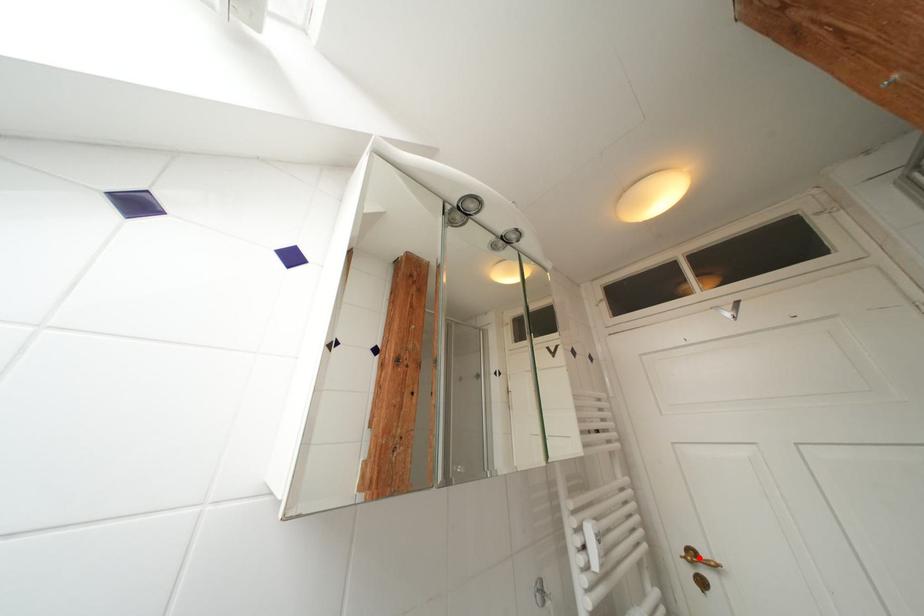
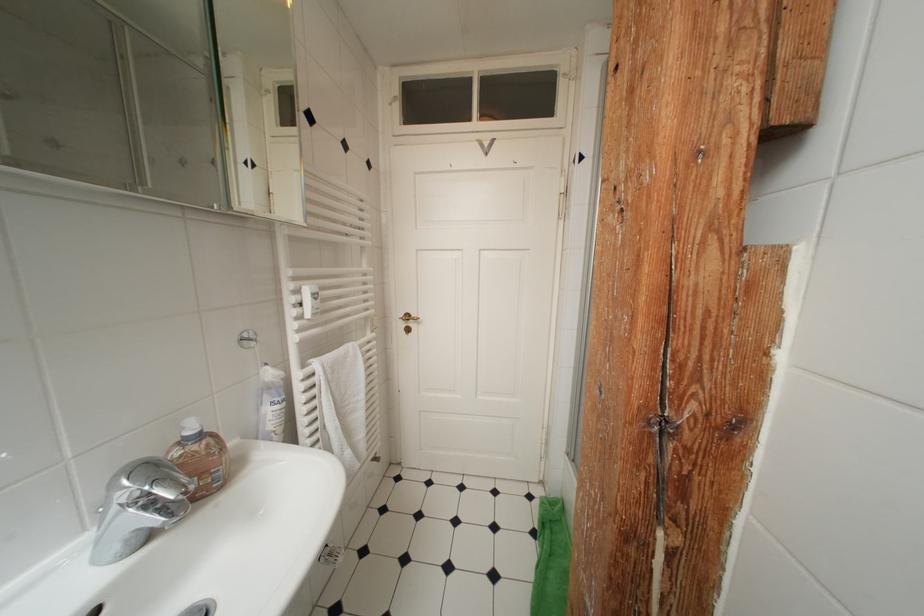
Find the pixel in the second image that matches the highlighted location in the first image.

(415, 320)